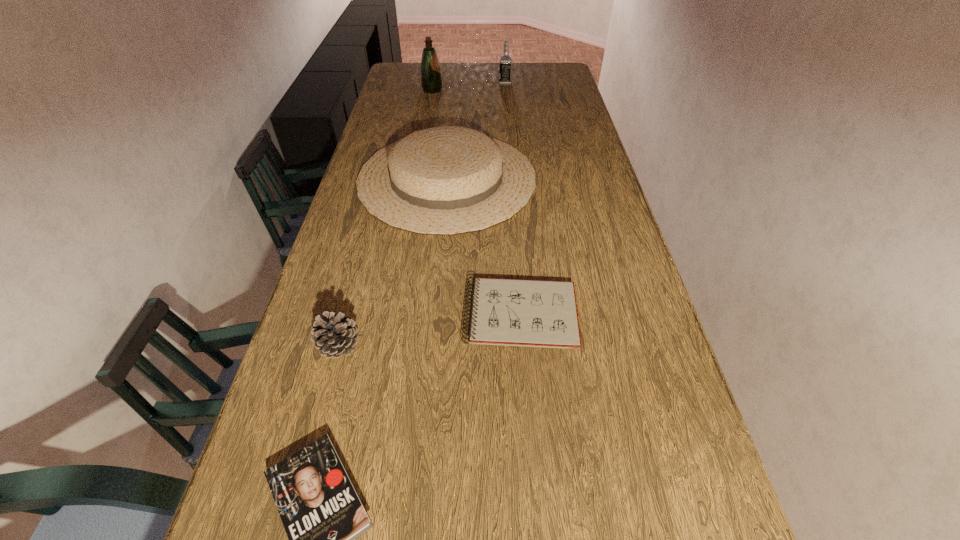
The width and height of the screenshot is (960, 540). Find the location of `vacant space that satisfies the following two spatial constraints: 1. on the front-facing side of the notepad; 2. on the right side of the olive oil`. vacant space that satisfies the following two spatial constraints: 1. on the front-facing side of the notepad; 2. on the right side of the olive oil is located at coordinates (393, 315).

The height and width of the screenshot is (540, 960). Find the location of `vacant space that satisfies the following two spatial constraints: 1. on the back side of the notepad; 2. on the front-facing side of the fifth nearest object`. vacant space that satisfies the following two spatial constraints: 1. on the back side of the notepad; 2. on the front-facing side of the fifth nearest object is located at coordinates (502, 90).